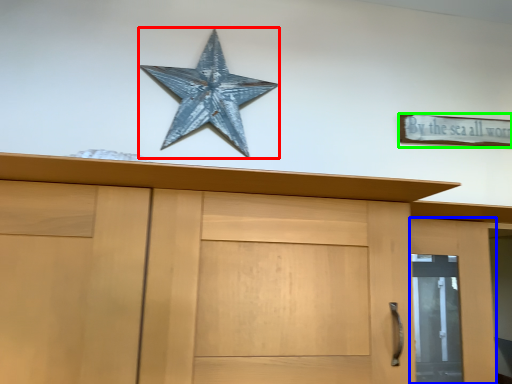
Question: Estimate the real-world distances between objects in this image. Which object is farther from starfish (highlighted by a red box), door (highlighted by a blue box) or magnet (highlighted by a green box)?

Choices:
 (A) door
 (B) magnet

Answer: (A)